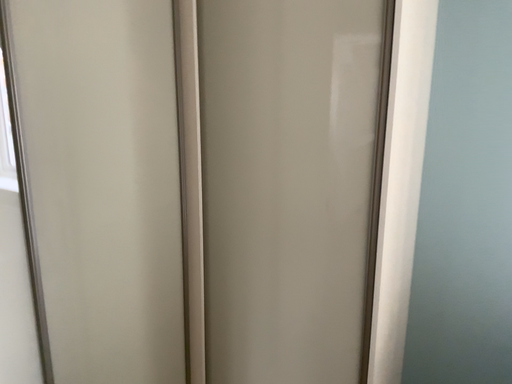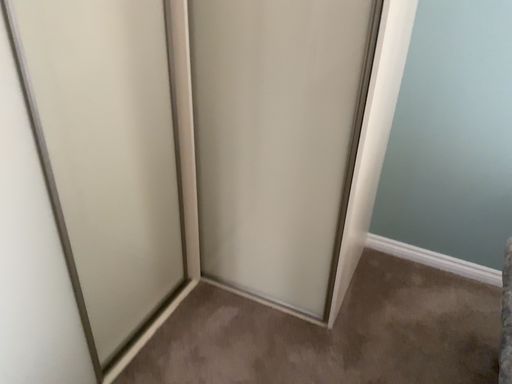
Question: How did the camera likely rotate when shooting the video?

Choices:
 (A) rotated upward
 (B) rotated downward

Answer: (B)